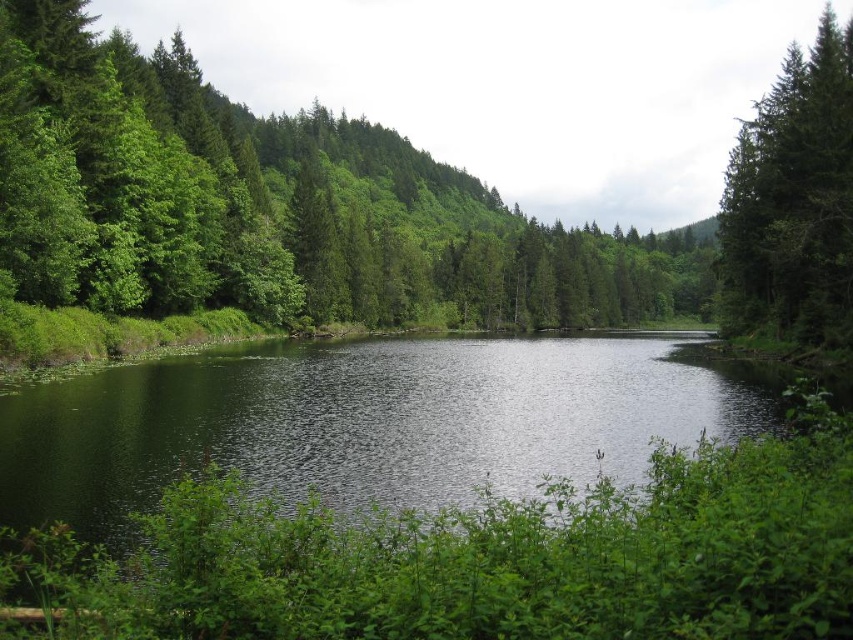
You are standing at the edge of the forest and want to reach the green smooth water at center. Based on the coordinates provided, in which direction should you walk to reach it?

The green smooth water at center is located at coordinates point (x=369, y=420), so you should walk towards the center of the image to reach it.

You are an observer standing at the edge of the water in the scene. You see the green matte tree at center and the green matte tree at upper right. Which tree is closer to your left side?

The green matte tree at center is positioned on the left side of green matte tree at upper right, so the green matte tree at center is closer to your left side.